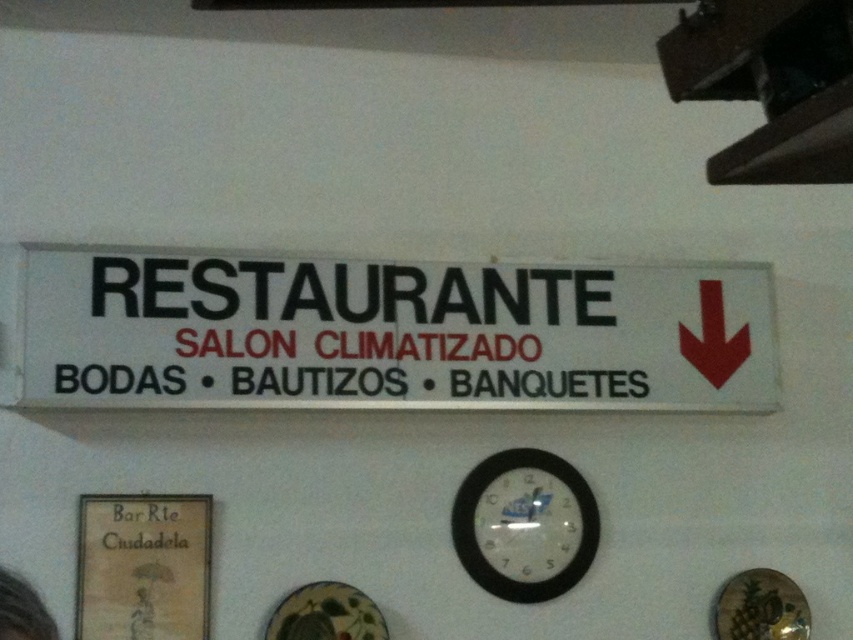
You are standing in front of a signboard that has the words RESTAURANTE, SALON CLIMATIZADO, BODAS, BAUTIZOS, BANQUETES, and a red downward arrow. There is also a point marked at coordinates point (143, 566). Based on the signboard layout, where is the point located?

The point (143, 566) is on the matte paper sign at center.

You are standing in front of a wall with two items. The matte paper sign at center and the black plastic clock at center. Which object is larger in size?

The black plastic clock at center is larger than the matte paper sign at center.

You are standing in front of a wall with two objects. You see a white plastic sign at center and a black plastic clock at center. Which object is located to the left of the other?

The white plastic sign at center is positioned on the left side of black plastic clock at center.